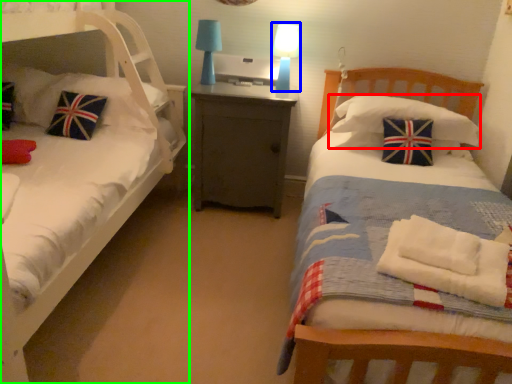
Question: Which object is positioned farthest from pillow (highlighted by a red box)? Select from table lamp (highlighted by a blue box) and bed (highlighted by a green box).

Choices:
 (A) table lamp
 (B) bed

Answer: (B)